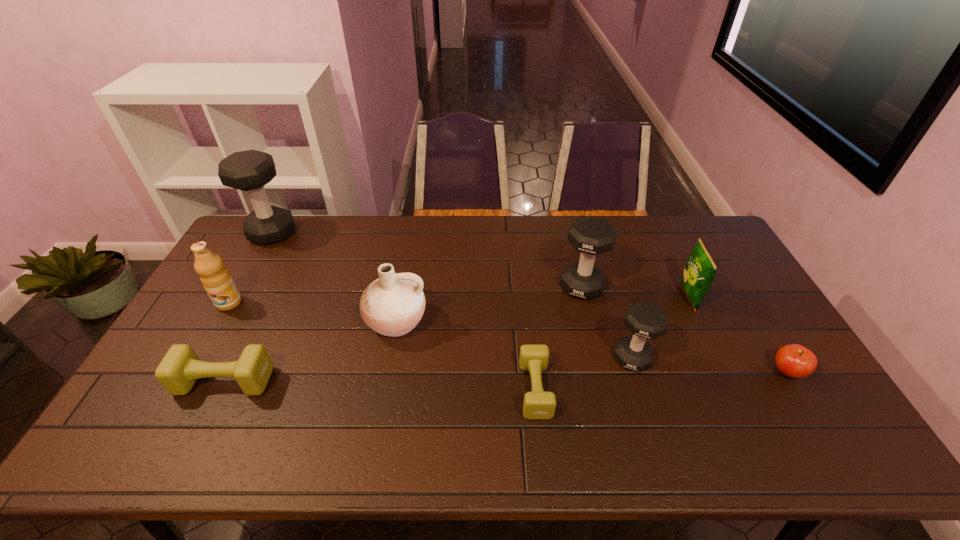
Locate which gray dumbbell is the closest to the fourth shortest dumbbell. Please provide its 2D coordinates. Your answer should be formatted as a tuple, i.e. [(x, y)], where the tuple contains the x and y coordinates of a point satisfying the conditions above.

[(645, 320)]

The image size is (960, 540). I want to click on gray dumbbell that is the closest one to the fourth nearest dumbbell, so click(x=645, y=320).

Locate an element on the screen. vacant space that satisfies the following two spatial constraints: 1. to pour from the handle of the smallest gray dumbbell; 2. on the left side of the reddish-brown pottery is located at coordinates (389, 358).

This screenshot has height=540, width=960. I want to click on vacant area that satisfies the following two spatial constraints: 1. on the front-facing side of the green crisp (potato chip); 2. on the left side of the apple, so click(x=725, y=372).

The width and height of the screenshot is (960, 540). Find the location of `free location that satisfies the following two spatial constraints: 1. on the front side of the tallest dumbbell; 2. on the right side of the third tallest dumbbell`. free location that satisfies the following two spatial constraints: 1. on the front side of the tallest dumbbell; 2. on the right side of the third tallest dumbbell is located at coordinates (202, 358).

This screenshot has width=960, height=540. I want to click on vacant space that satisfies the following two spatial constraints: 1. on the front side of the second farthest gray dumbbell; 2. on the left side of the farthest gray dumbbell, so click(242, 287).

Locate an element on the screen. vacant space that satisfies the following two spatial constraints: 1. on the back side of the right olive dumbbell; 2. on the left side of the nearest gray dumbbell is located at coordinates 532,358.